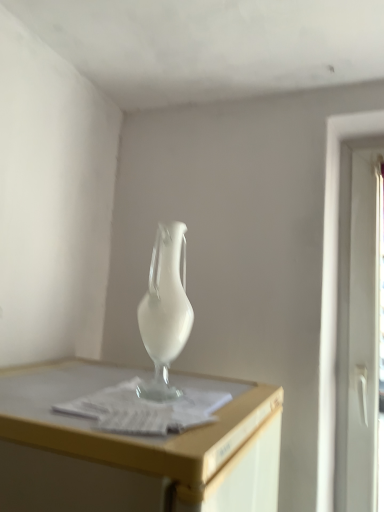
Question: Would you say white plastic screen door at right contains satin white vase at center?

Choices:
 (A) no
 (B) yes

Answer: (A)

Question: Can you confirm if white plastic screen door at right is thinner than satin white vase at center?

Choices:
 (A) no
 (B) yes

Answer: (B)

Question: Is white plastic screen door at right at the right side of satin white vase at center?

Choices:
 (A) yes
 (B) no

Answer: (A)

Question: Does white plastic screen door at right appear on the left side of satin white vase at center?

Choices:
 (A) no
 (B) yes

Answer: (A)

Question: Does white plastic screen door at right have a larger size compared to satin white vase at center?

Choices:
 (A) no
 (B) yes

Answer: (B)

Question: Considering the relative sizes of white plastic screen door at right and satin white vase at center in the image provided, is white plastic screen door at right taller than satin white vase at center?

Choices:
 (A) no
 (B) yes

Answer: (B)

Question: Considering the relative sizes of satin white vase at center and white paper at center in the image provided, is satin white vase at center shorter than white paper at center?

Choices:
 (A) yes
 (B) no

Answer: (B)

Question: Considering the relative sizes of satin white vase at center and white paper at center in the image provided, is satin white vase at center thinner than white paper at center?

Choices:
 (A) no
 (B) yes

Answer: (B)

Question: Considering the relative sizes of satin white vase at center and white paper at center in the image provided, is satin white vase at center wider than white paper at center?

Choices:
 (A) yes
 (B) no

Answer: (B)

Question: Is satin white vase at center bigger than white paper at center?

Choices:
 (A) yes
 (B) no

Answer: (A)

Question: Is satin white vase at center completely or partially outside of white paper at center?

Choices:
 (A) no
 (B) yes

Answer: (B)

Question: Does satin white vase at center appear on the left side of white paper at center?

Choices:
 (A) yes
 (B) no

Answer: (B)

Question: Is white plastic screen door at right smaller than white paper at center?

Choices:
 (A) no
 (B) yes

Answer: (A)